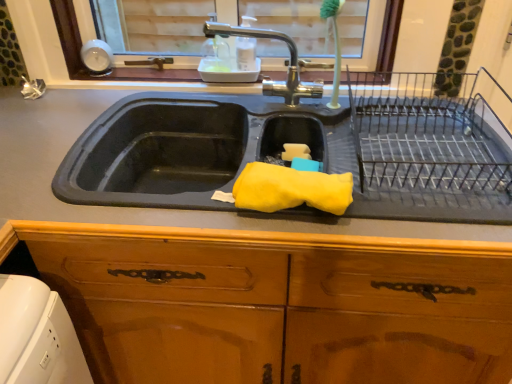
Where is `blank space to the left of yellow sponge at sink`? blank space to the left of yellow sponge at sink is located at coordinates [x=192, y=209].